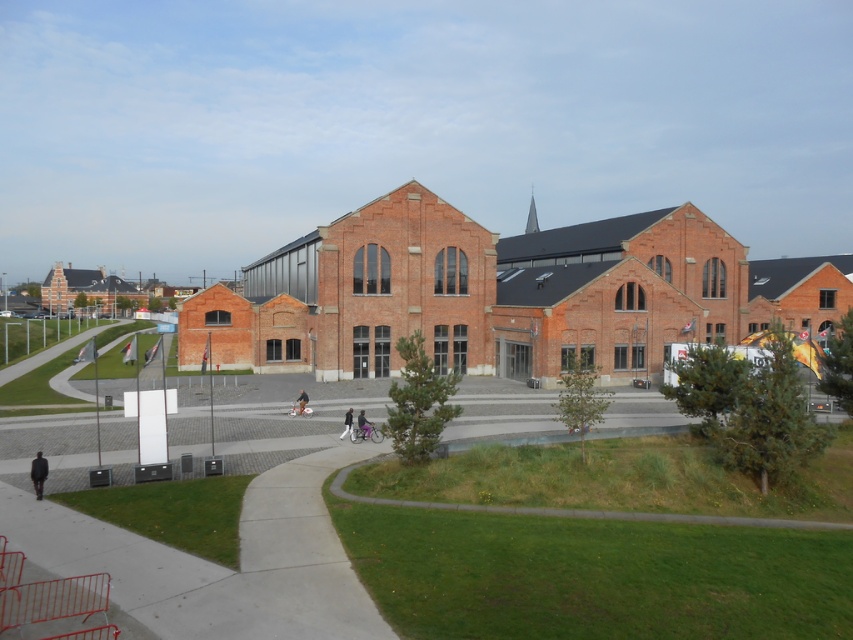
Looking at this image, which of these two, dark gray jacket at lower left or dark gray fabric pants at center, stands taller?

Standing taller between the two is dark gray fabric pants at center.

From the picture: Can you confirm if dark gray jacket at lower left is positioned to the left of dark gray fabric pants at center?

Indeed, dark gray jacket at lower left is positioned on the left side of dark gray fabric pants at center.

Image resolution: width=853 pixels, height=640 pixels. What do you see at coordinates (38, 474) in the screenshot? I see `dark gray jacket at lower left` at bounding box center [38, 474].

This screenshot has width=853, height=640. I want to click on dark gray jacket at lower left, so click(38, 474).

Which is above, dark blue jeans at center or black matte person at center?

black matte person at center is above.

Can you confirm if dark blue jeans at center is wider than black matte person at center?

In fact, dark blue jeans at center might be narrower than black matte person at center.

Is point (360, 424) more distant than point (294, 404)?

That is False.

Image resolution: width=853 pixels, height=640 pixels. In order to click on dark blue jeans at center in this screenshot , I will do `click(363, 426)`.

Which is above, dark gray jacket at lower left or black matte person at center?

Positioned higher is dark gray jacket at lower left.

Can you confirm if dark gray jacket at lower left is thinner than black matte person at center?

Correct, dark gray jacket at lower left's width is less than black matte person at center's.

Does point (45, 467) lie behind point (300, 412)?

No, (45, 467) is closer to viewer.

In order to click on dark gray jacket at lower left in this screenshot , I will do `click(38, 474)`.